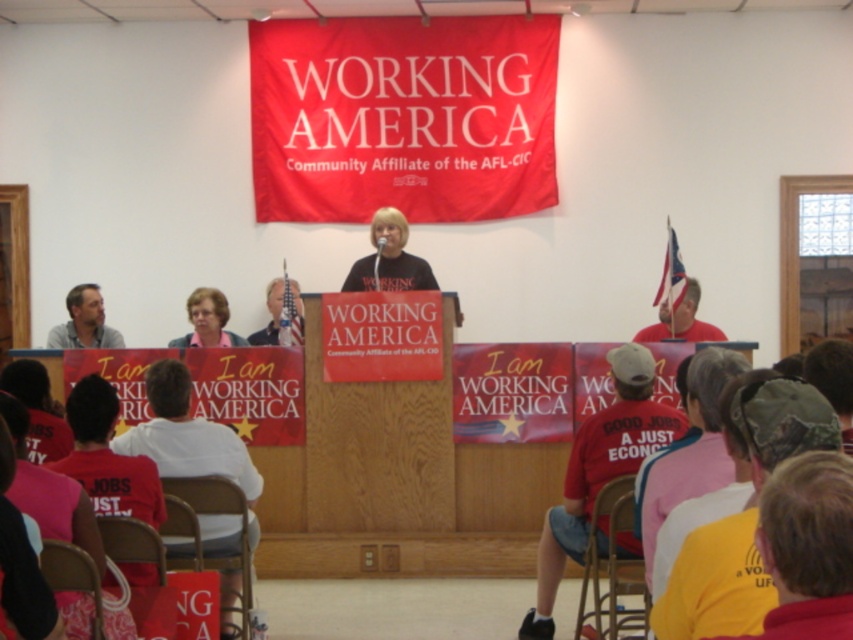
You are standing at the point labeled point (219, 307) in the scene. Can you see the point labeled point (685, 330) from your current position?

Yes, because point (219, 307) is in front of point (685, 330), so the latter is behind the former and thus visible from its position.